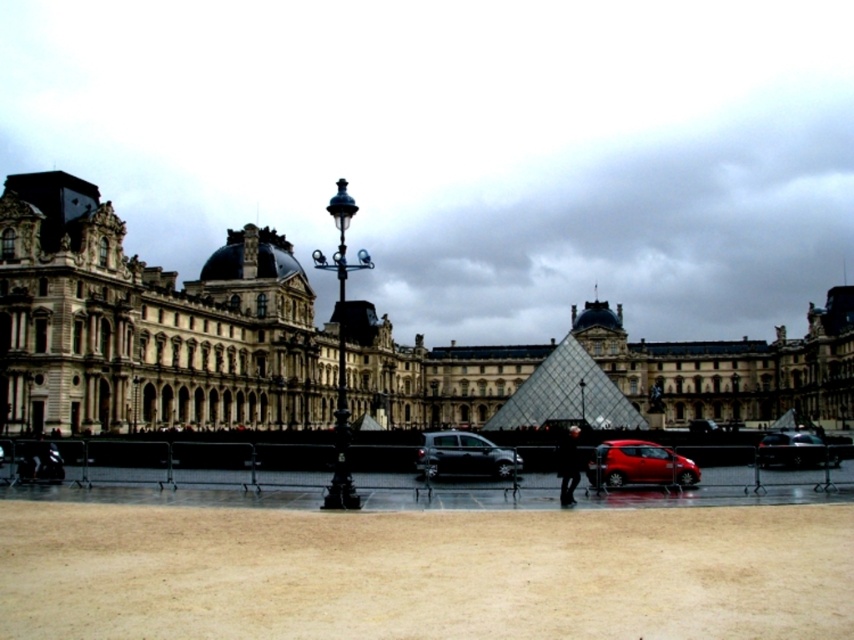
Is shiny black car at center in front of dark fabric jacket at center?

No, shiny black car at center is behind dark fabric jacket at center.

Between shiny black car at center and dark fabric jacket at center, which one has more height?

dark fabric jacket at center

Identify the location of shiny black car at center. (464, 456).

Identify the location of shiny black car at center. (464, 456).

Does shiny red car at center have a lesser width compared to shiny black car at right?

Yes, shiny red car at center is thinner than shiny black car at right.

Who is more forward, (664, 456) or (788, 445)?

Point (664, 456) is more forward.

Find the location of a particular element. shiny red car at center is located at coordinates (639, 465).

I want to click on shiny red car at center, so click(x=639, y=465).

Which is in front, point (812, 451) or point (575, 444)?

Point (575, 444) is in front.

Is point (787, 460) less distant than point (566, 449)?

No.

The image size is (854, 640). What are the coordinates of `shiny black car at right` in the screenshot? It's located at (794, 451).